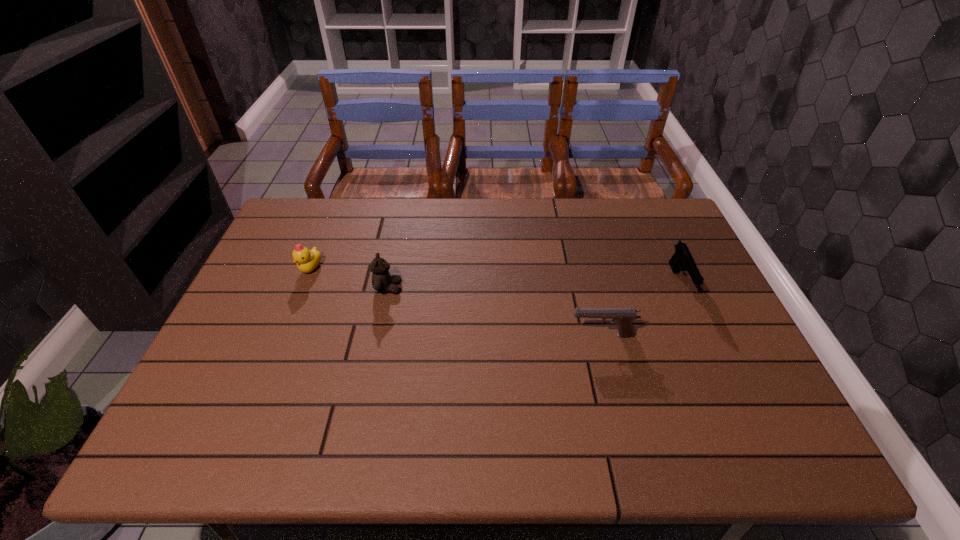
Locate an element on the screen. The image size is (960, 540). vacant space located on the front-facing side of the rightmost object is located at coordinates (725, 379).

Locate an element on the screen. The width and height of the screenshot is (960, 540). free region located on the front-facing side of the leftmost object is located at coordinates (264, 383).

I want to click on object located in the left edge section of the desktop, so click(307, 261).

Identify the location of object at the right edge. This screenshot has height=540, width=960. (682, 259).

In the image, there is a desktop. What are the coordinates of `vacant space at the far edge` in the screenshot? It's located at (459, 240).

In the image, there is a desktop. Where is `blank space at the left edge`? blank space at the left edge is located at coordinates (283, 298).

In the image, there is a desktop. Where is `vacant space at the right edge`? vacant space at the right edge is located at coordinates (666, 277).

This screenshot has width=960, height=540. In the image, there is a desktop. What are the coordinates of `vacant space at the far left corner` in the screenshot? It's located at coord(308,208).

Where is `vacant space at the far right corner`? Image resolution: width=960 pixels, height=540 pixels. vacant space at the far right corner is located at coordinates (669, 236).

In order to click on free space between the teddy bear and the leftmost object in this screenshot , I will do `click(349, 278)`.